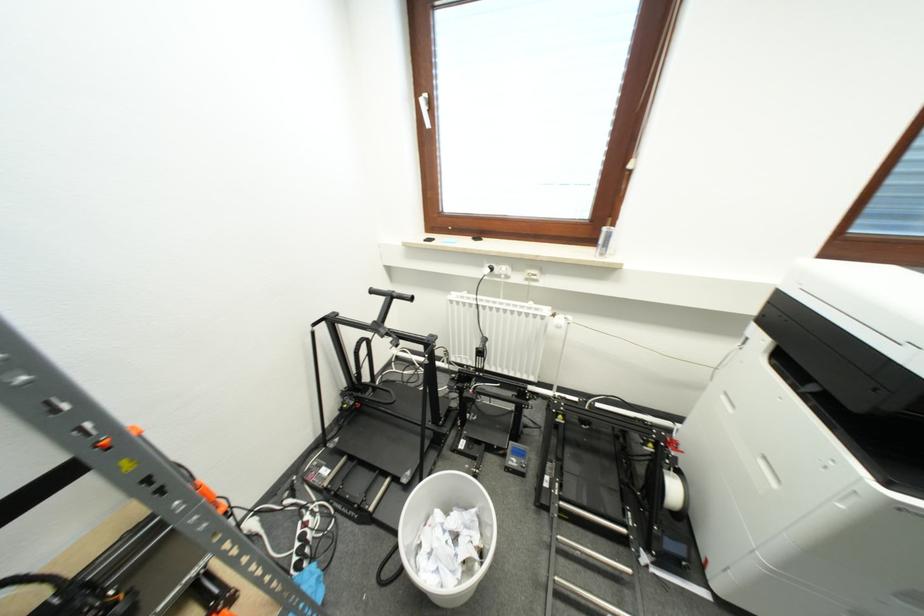
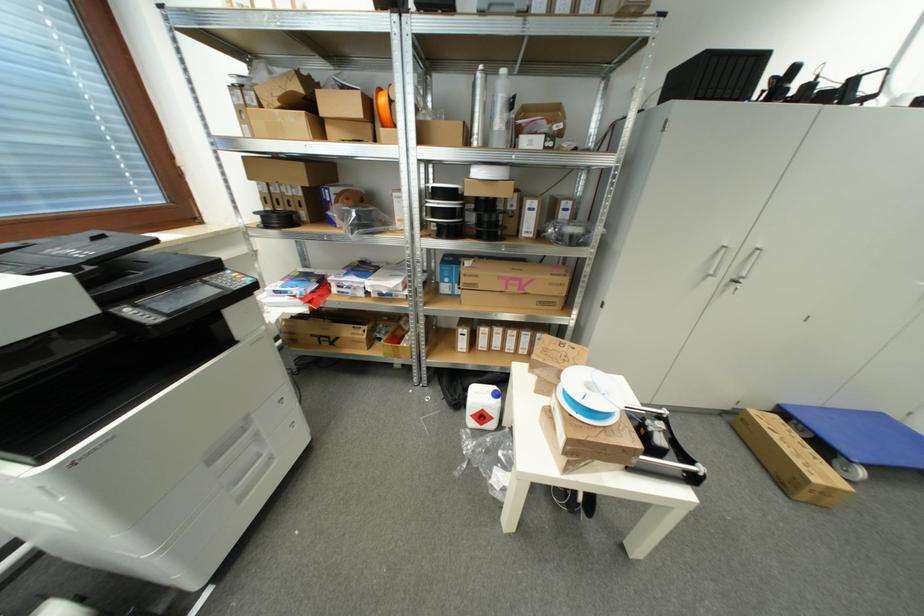
How did the camera likely rotate?

The rotation direction of the camera is right-down.